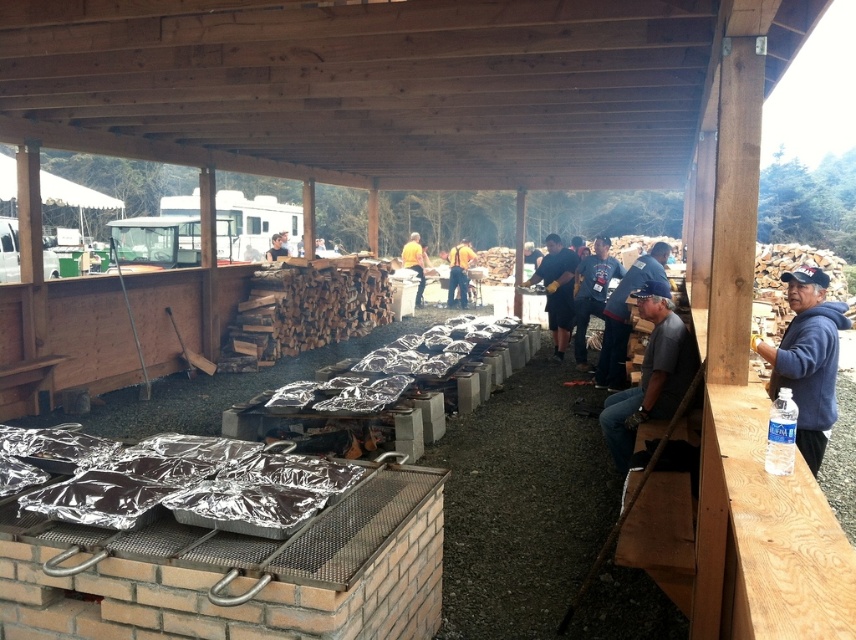
Can you confirm if blue fleece jacket at right is positioned above gray fabric shirt at center?

Indeed, blue fleece jacket at right is positioned over gray fabric shirt at center.

Consider the image. Does blue fleece jacket at right have a greater height compared to gray fabric shirt at center?

Incorrect, blue fleece jacket at right's height is not larger of gray fabric shirt at center's.

Find the location of `blue fleece jacket at right`. blue fleece jacket at right is located at coordinates (807, 358).

Is gray fabric shirt at center below yellow fabric at center?

Indeed, gray fabric shirt at center is positioned under yellow fabric at center.

Does gray fabric shirt at center have a lesser height compared to yellow fabric at center?

Correct, gray fabric shirt at center is not as tall as yellow fabric at center.

Is point (670, 353) farther from viewer compared to point (467, 300)?

No, (670, 353) is in front of (467, 300).

Locate an element on the screen. This screenshot has width=856, height=640. gray fabric shirt at center is located at coordinates (651, 374).

Which is more to the right, blue fleece jacket at right or dark gray cotton shirt at center?

From the viewer's perspective, dark gray cotton shirt at center appears more on the right side.

This screenshot has width=856, height=640. I want to click on blue fleece jacket at right, so click(807, 358).